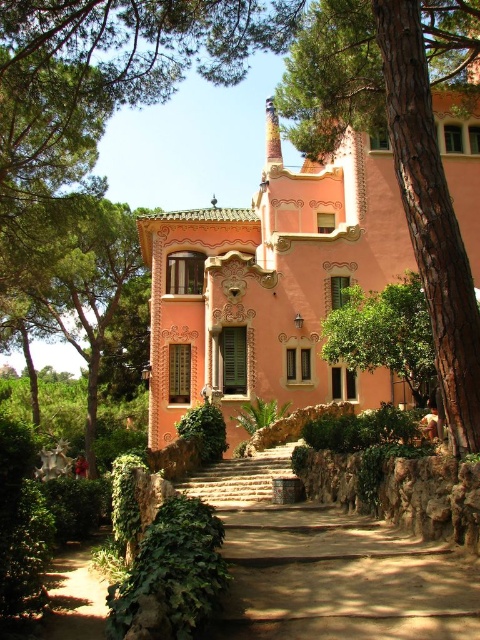
Question: In this image, where is green leafy tree at center located relative to brown stone stairs at center?

Choices:
 (A) left
 (B) right

Answer: (B)

Question: Which point is closer to the camera taking this photo?

Choices:
 (A) (403, 280)
 (B) (178, 484)
 (C) (37, 308)

Answer: (B)

Question: Can you confirm if brown stone path at center is thinner than brown stone stairs at center?

Choices:
 (A) yes
 (B) no

Answer: (B)

Question: Which point is farther from the camera taking this photo?

Choices:
 (A) pyautogui.click(x=384, y=340)
 (B) pyautogui.click(x=420, y=209)
 (C) pyautogui.click(x=29, y=289)

Answer: (C)

Question: Which point appears farthest from the camera in this image?

Choices:
 (A) (285, 22)
 (B) (377, 332)
 (C) (344, 621)

Answer: (B)

Question: Is green leafy tree at center positioned at the back of brown stone stairs at center?

Choices:
 (A) no
 (B) yes

Answer: (B)